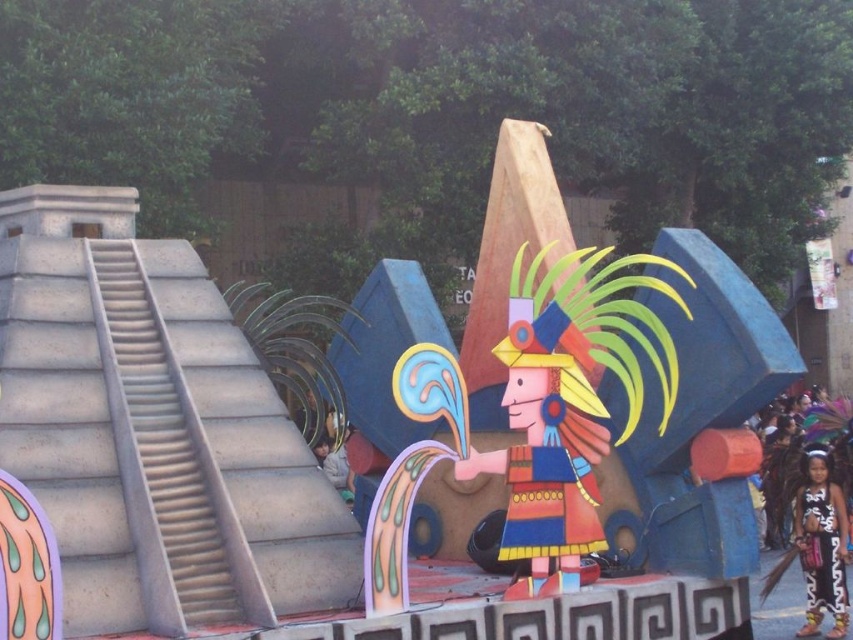
You are a photographer positioned in front of the float. You want to take a photo that includes both the black and white costume at center and the black leather dress at lower right. Which object will appear larger in the photo?

The black and white costume at center will appear larger in the photo because it is closer to the viewer than the black leather dress at lower right.

You are an event planner trying to arrange the float for a parade. You need to ensure that the wooden painted figure at center and the black and white costume at center are positioned so that they are both visible to the audience. Given their sizes, which one should be placed closer to the front to ensure visibility?

The wooden painted figure at center occupies less space than the black and white costume at center, so the larger black and white costume at center should be placed closer to the front to ensure both are visible.